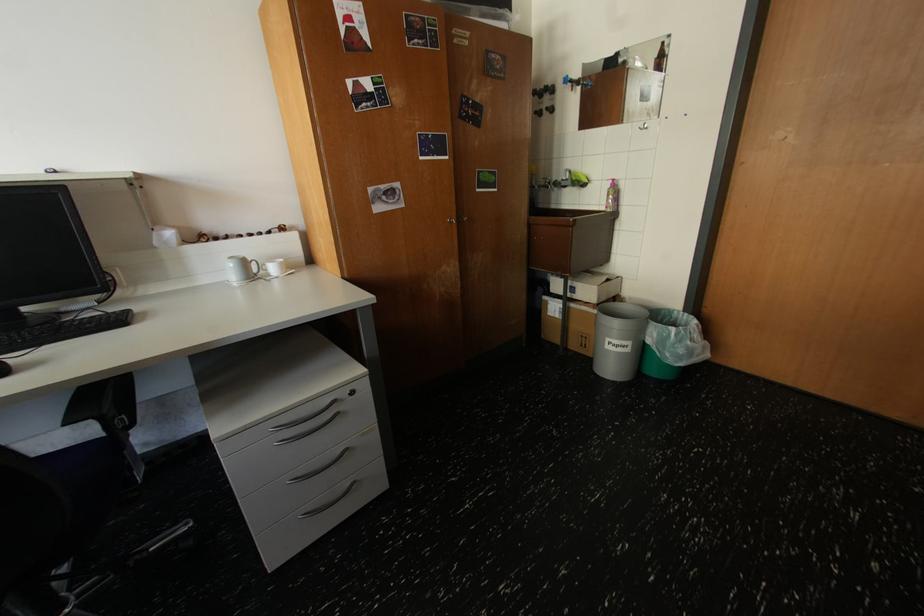
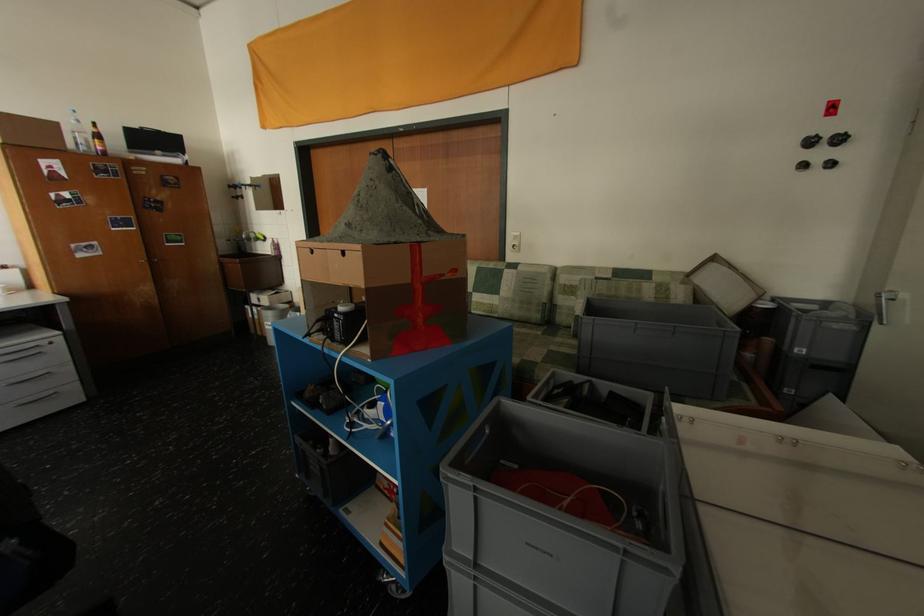
Locate, in the second image, the point that corresponds to pixel 343 403 in the first image.

(45, 347)